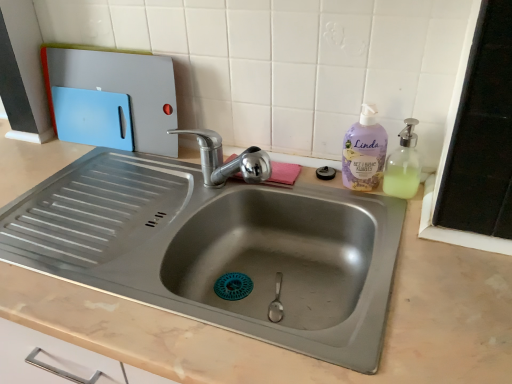
Question: Is translucent plastic soap dispenser at right to the left of blue plastic cutting board at upper left from the viewer's perspective?

Choices:
 (A) yes
 (B) no

Answer: (B)

Question: From a real-world perspective, is translucent plastic soap dispenser at right physically above blue plastic cutting board at upper left?

Choices:
 (A) no
 (B) yes

Answer: (A)

Question: Considering the relative positions of translucent plastic soap dispenser at right and blue plastic cutting board at upper left in the image provided, is translucent plastic soap dispenser at right behind blue plastic cutting board at upper left?

Choices:
 (A) yes
 (B) no

Answer: (B)

Question: Can you confirm if translucent plastic soap dispenser at right is shorter than blue plastic cutting board at upper left?

Choices:
 (A) yes
 (B) no

Answer: (A)

Question: Is translucent plastic soap dispenser at right thinner than blue plastic cutting board at upper left?

Choices:
 (A) yes
 (B) no

Answer: (B)

Question: Is translucent plastic soap dispenser at right oriented towards blue plastic cutting board at upper left?

Choices:
 (A) no
 (B) yes

Answer: (A)

Question: From the image's perspective, would you say blue plastic cutting board at upper left is shown under lavender plastic bottle at right?

Choices:
 (A) yes
 (B) no

Answer: (B)

Question: From a real-world perspective, is blue plastic cutting board at upper left physically below lavender plastic bottle at right?

Choices:
 (A) no
 (B) yes

Answer: (A)

Question: Would you say blue plastic cutting board at upper left contains lavender plastic bottle at right?

Choices:
 (A) yes
 (B) no

Answer: (B)

Question: Does blue plastic cutting board at upper left have a larger size compared to lavender plastic bottle at right?

Choices:
 (A) no
 (B) yes

Answer: (B)

Question: Does blue plastic cutting board at upper left have a smaller size compared to lavender plastic bottle at right?

Choices:
 (A) no
 (B) yes

Answer: (A)

Question: Is blue plastic cutting board at upper left shorter than lavender plastic bottle at right?

Choices:
 (A) no
 (B) yes

Answer: (A)

Question: Would you say translucent plastic soap dispenser at right is part of lavender plastic bottle at right's contents?

Choices:
 (A) no
 (B) yes

Answer: (A)